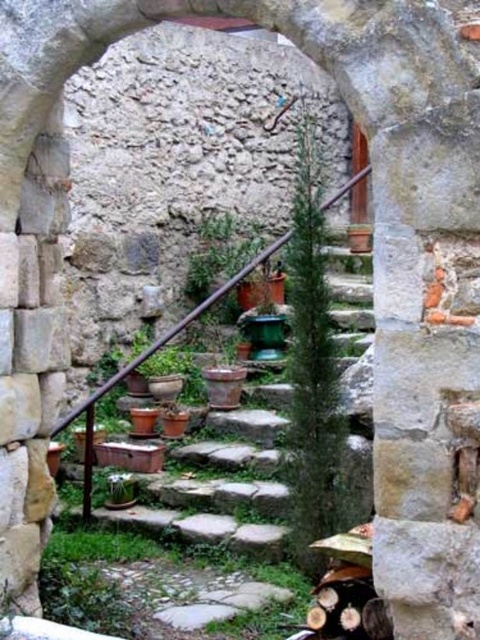
You are a gardener who wants to place a new small statue between the green textured plant at center and the green matte plant at center. Which plant should the statue be closer to if you want it to look proportionally balanced?

The statue should be closer to the green matte plant at center because the green textured plant at center is larger, so placing the statue closer to the smaller plant helps balance the composition.

You are standing at the base of the rustic stone staircase leading into the garden. You notice a point marked at coordinates (311, 364). What object is located at that specific point?

At point (311, 364) lies a green textured plant at center.